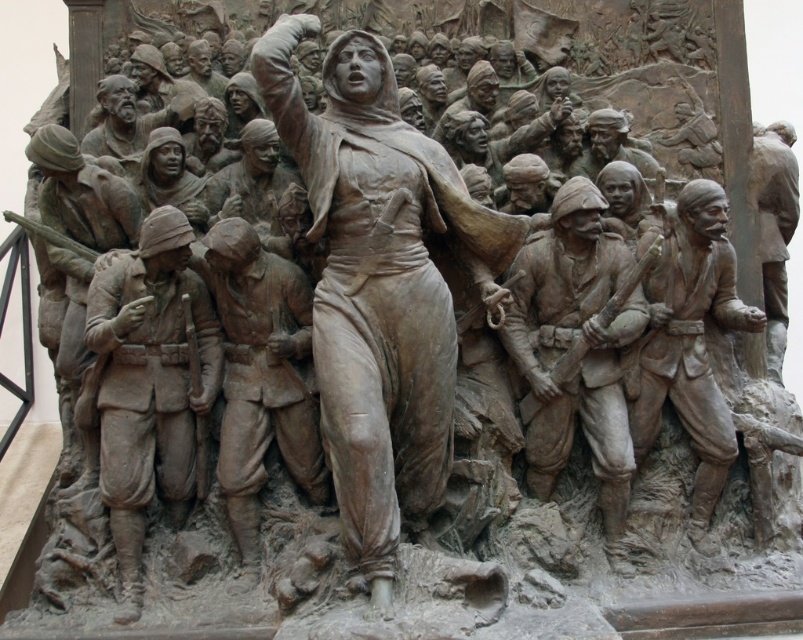
What do you see at coordinates (575, 348) in the screenshot?
I see `matte bronze soldier at right` at bounding box center [575, 348].

Who is positioned more to the left, matte bronze soldier at right or bronze statue at right?

matte bronze soldier at right is more to the left.

In the scene shown: Measure the distance between matte bronze soldier at right and camera.

matte bronze soldier at right and camera are 52.30 meters apart from each other.

The height and width of the screenshot is (640, 803). I want to click on matte bronze soldier at right, so click(575, 348).

Is bronze statue at center bigger than rustic bronze soldier at right?

Yes.

Is bronze statue at center to the left of rustic bronze soldier at right from the viewer's perspective?

Yes, bronze statue at center is to the left of rustic bronze soldier at right.

Measure the distance between point (404, 397) and camera.

Point (404, 397) is 50.79 meters from camera.

I want to click on bronze statue at center, so click(382, 285).

Does bronze statue at center appear over bronze statue at right?

No, bronze statue at center is not above bronze statue at right.

Between point (516, 240) and point (761, 205), which one is positioned behind?

The point (761, 205) is behind.

Find the location of a particular element. The height and width of the screenshot is (640, 803). bronze statue at center is located at coordinates (382, 285).